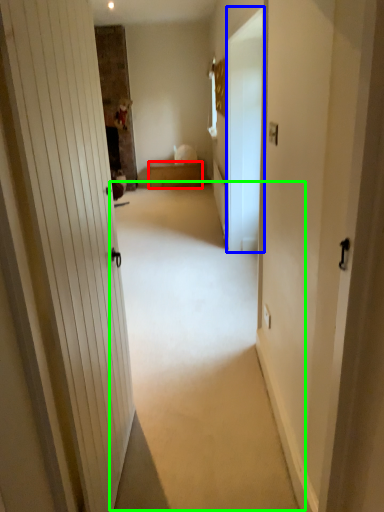
Question: Which is nearer to the furniture (highlighted by a red box)? screen door (highlighted by a blue box) or plain (highlighted by a green box).

Choices:
 (A) screen door
 (B) plain

Answer: (A)